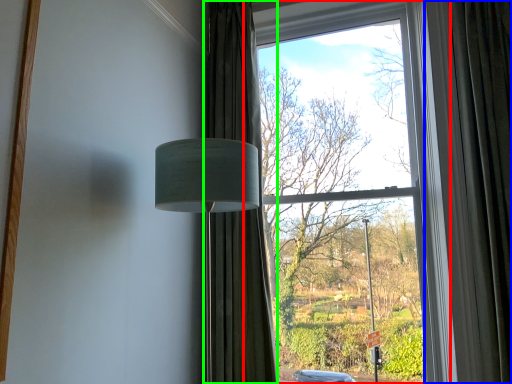
Question: Which object is positioned closest to window (highlighted by a red box)? Select from curtain (highlighted by a blue box) and curtain (highlighted by a green box).

Choices:
 (A) curtain
 (B) curtain

Answer: (A)